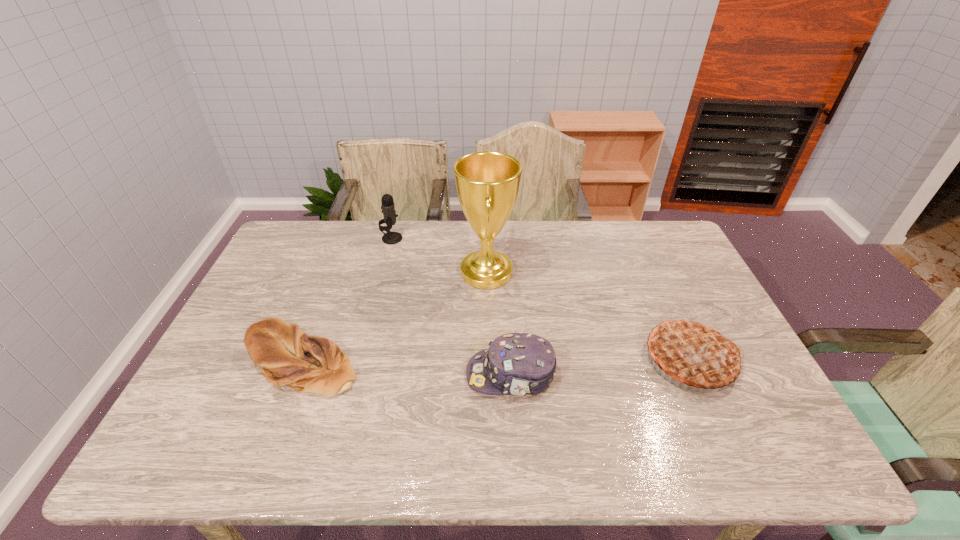
Find the location of `free region located 0.280m on the front-facing side of the headwear`. free region located 0.280m on the front-facing side of the headwear is located at coordinates (356, 375).

Image resolution: width=960 pixels, height=540 pixels. I want to click on vacant region located on the front-facing side of the headwear, so click(308, 375).

This screenshot has width=960, height=540. What are the coordinates of `vacant region located 0.310m on the front-facing side of the headwear` in the screenshot? It's located at (344, 375).

This screenshot has width=960, height=540. I want to click on vacant region located 0.070m on the front of the shortest object, so pos(276,426).

The image size is (960, 540). Identify the location of award that is at the far edge. point(487,183).

Locate an element on the screen. microphone at the far edge is located at coordinates (388, 209).

Where is `object present at the left edge`? object present at the left edge is located at coordinates (287, 356).

Locate an element on the screen. object positioned at the right edge is located at coordinates (693, 352).

Locate an element on the screen. vacant area at the far edge is located at coordinates (330, 240).

The image size is (960, 540). I want to click on vacant area at the near edge of the desktop, so click(x=326, y=442).